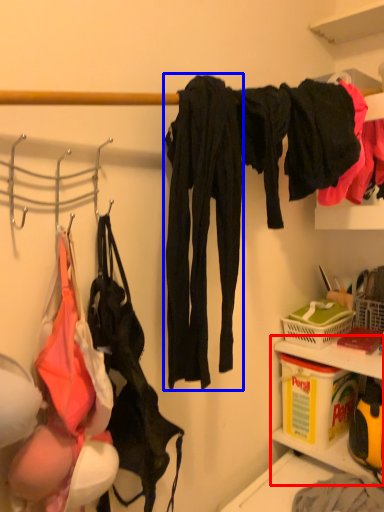
Question: Which point is closer to the camera, cabinet (highlighted by a red box) or clothing (highlighted by a blue box)?

Choices:
 (A) cabinet
 (B) clothing

Answer: (B)